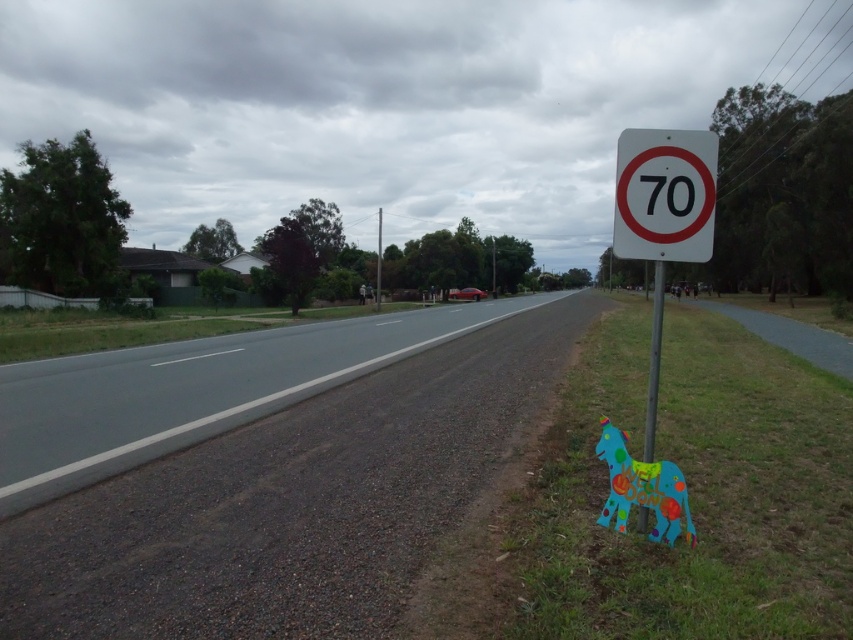
You are a delivery driver approaching the blue elephant near the speed limit sign on the roadside. You need to deliver a package to a point that is behind the blue elephant. Which of the two points, point [660,317] or point [381,250], should you choose?

Point [660,317] is in front of point [381,250]. To deliver the package behind the blue elephant, you should choose point [381,250] because it is behind point [660,317] which is where the blue elephant is located.

You are a driver approaching the white plastic speed limit sign at right and the metallic pole at right on the roadside. Which object will appear taller to you as you drive by?

The white plastic speed limit sign at right is much taller than the metallic pole at right, so it will appear taller as you drive by.